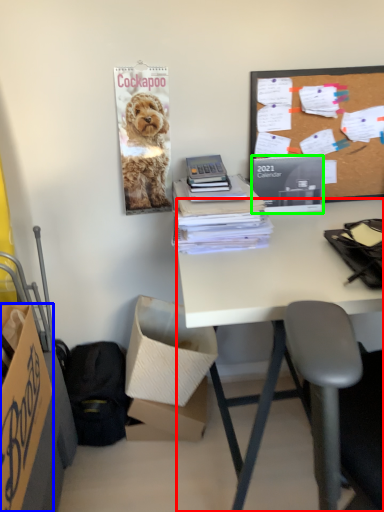
Question: Estimate the real-world distances between objects in this image. Which object is closer to desk (highlighted by a red box), box (highlighted by a blue box) or magazine (highlighted by a green box)?

Choices:
 (A) box
 (B) magazine

Answer: (B)